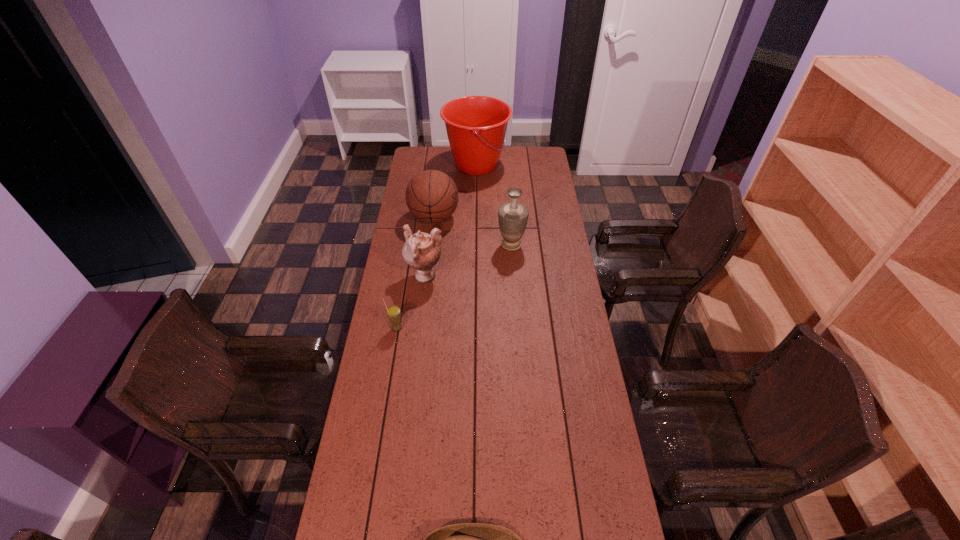
This screenshot has width=960, height=540. In order to click on vacant area between the fifth nearest object and the second nearest object in this screenshot , I will do `click(416, 273)`.

Identify the location of unoccupied area between the left urn and the right urn. (468, 261).

This screenshot has height=540, width=960. In order to click on free space between the basketball and the right urn in this screenshot , I will do `click(472, 231)`.

The image size is (960, 540). What are the coordinates of `empty space between the left urn and the farthest object` in the screenshot? It's located at click(451, 221).

This screenshot has width=960, height=540. I want to click on empty space between the basketball and the second shortest object, so point(416,273).

Identify the location of vacant area that lies between the fourth nearest object and the farthest object. This screenshot has height=540, width=960. (493, 205).

Identify the location of vacant area that lies between the farther urn and the third nearest object. Image resolution: width=960 pixels, height=540 pixels. (468, 261).

Select which object appears as the closest to the left urn. Please provide its 2D coordinates. Your answer should be formatted as a tuple, i.e. [(x, y)], where the tuple contains the x and y coordinates of a point satisfying the conditions above.

[(393, 312)]

Locate which object ranks second in proximity to the farther urn. Please provide its 2D coordinates. Your answer should be formatted as a tuple, i.e. [(x, y)], where the tuple contains the x and y coordinates of a point satisfying the conditions above.

[(421, 251)]

Where is `blank space that satisfies the following two spatial constraints: 1. with the handle attached to the rim of the right urn; 2. on the left side of the bucket`? blank space that satisfies the following two spatial constraints: 1. with the handle attached to the rim of the right urn; 2. on the left side of the bucket is located at coordinates (476, 245).